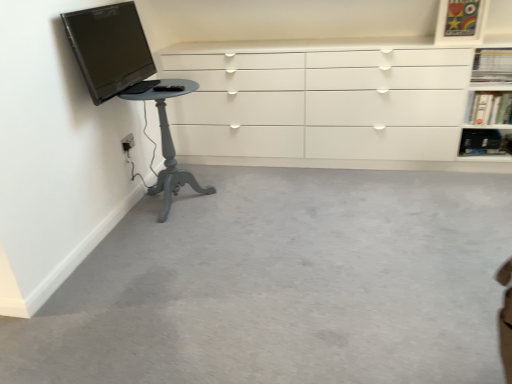
Question: Is matte black tv at upper left turned away from black plastic shelf at upper right, the first shelf positioned from the bottom?

Choices:
 (A) no
 (B) yes

Answer: (A)

Question: From the image's perspective, is matte black tv at upper left below black plastic shelf at upper right, placed as the third shelf when sorted from top to bottom?

Choices:
 (A) yes
 (B) no

Answer: (B)

Question: Considering the relative sizes of matte black tv at upper left and black plastic shelf at upper right, placed as the third shelf when sorted from top to bottom, in the image provided, is matte black tv at upper left thinner than black plastic shelf at upper right, placed as the third shelf when sorted from top to bottom,?

Choices:
 (A) no
 (B) yes

Answer: (A)

Question: Is matte black tv at upper left at the right side of black plastic shelf at upper right, placed as the third shelf when sorted from top to bottom?

Choices:
 (A) yes
 (B) no

Answer: (B)

Question: From the image's perspective, is matte black tv at upper left on black plastic shelf at upper right, placed as the third shelf when sorted from top to bottom?

Choices:
 (A) yes
 (B) no

Answer: (A)

Question: From a real-world perspective, is matte black tv at upper left under black plastic shelf at upper right, the first shelf positioned from the bottom?

Choices:
 (A) yes
 (B) no

Answer: (B)

Question: From a real-world perspective, is white glossy bookshelf at upper right, which is counted as the second shelf, starting from the top, positioned under white plastic electric outlet at lower left based on gravity?

Choices:
 (A) yes
 (B) no

Answer: (B)

Question: Is white plastic electric outlet at lower left inside white glossy bookshelf at upper right, the 2th shelf positioned from the bottom?

Choices:
 (A) no
 (B) yes

Answer: (A)

Question: Does white glossy bookshelf at upper right, the 2th shelf positioned from the bottom, turn towards white plastic electric outlet at lower left?

Choices:
 (A) yes
 (B) no

Answer: (B)

Question: Is white glossy bookshelf at upper right, which is counted as the second shelf, starting from the top, closer to the viewer compared to white plastic electric outlet at lower left?

Choices:
 (A) no
 (B) yes

Answer: (A)

Question: Considering the relative sizes of white glossy bookshelf at upper right, which is counted as the second shelf, starting from the top, and white plastic electric outlet at lower left in the image provided, is white glossy bookshelf at upper right, which is counted as the second shelf, starting from the top, taller than white plastic electric outlet at lower left?

Choices:
 (A) yes
 (B) no

Answer: (A)

Question: Is the position of white plastic electric outlet at lower left less distant than that of black plastic shelf at upper right, the first shelf positioned from the bottom?

Choices:
 (A) no
 (B) yes

Answer: (B)